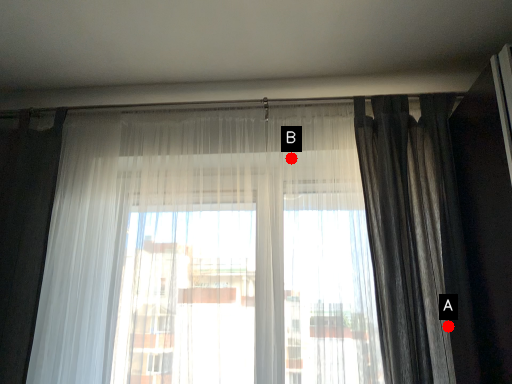
Question: Two points are circled on the image, labeled by A and B beside each circle. Which point is further to the camera?

Choices:
 (A) A is further
 (B) B is further

Answer: (B)